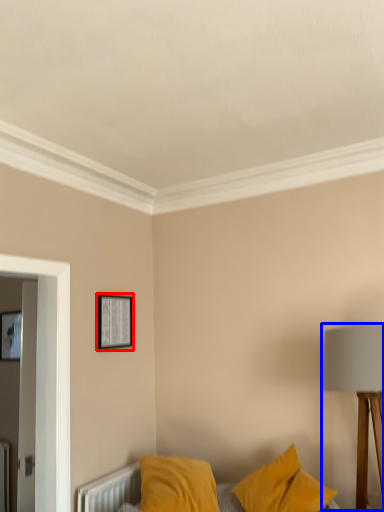
Question: Which object appears closest to the camera in this image, picture frame (highlighted by a red box) or table lamp (highlighted by a blue box)?

Choices:
 (A) picture frame
 (B) table lamp

Answer: (B)